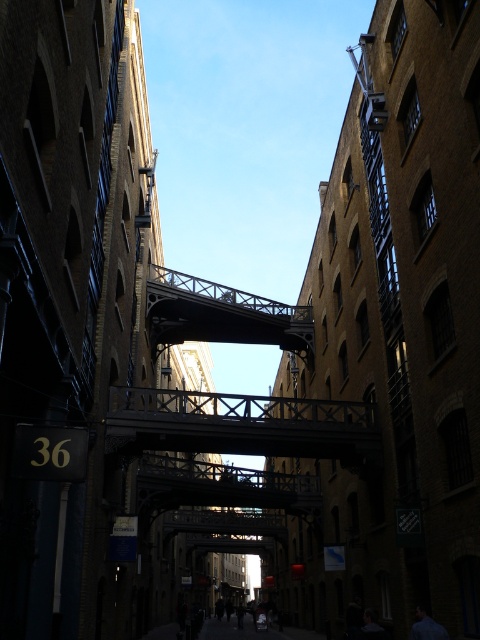
Between point (126, 426) and point (147, 291), which one is positioned in front?

Positioned in front is point (126, 426).

Who is more distant from viewer, (273,452) or (312,326)?

Point (312,326)

Is point (177, 433) in front of point (215, 324)?

Yes, it is in front of point (215, 324).

Where is `wooden bridge at center`? wooden bridge at center is located at coordinates (240, 424).